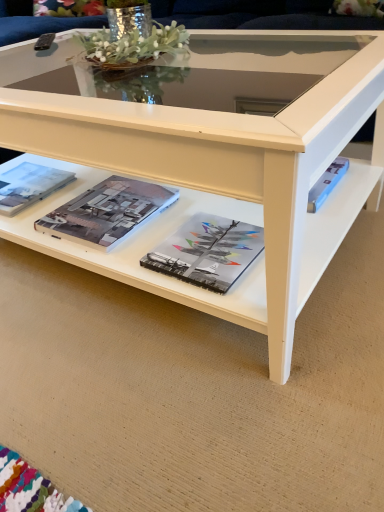
The height and width of the screenshot is (512, 384). I want to click on vacant point above matte paper magazine at center, the second magazine from the left (from a real-world perspective), so click(x=104, y=210).